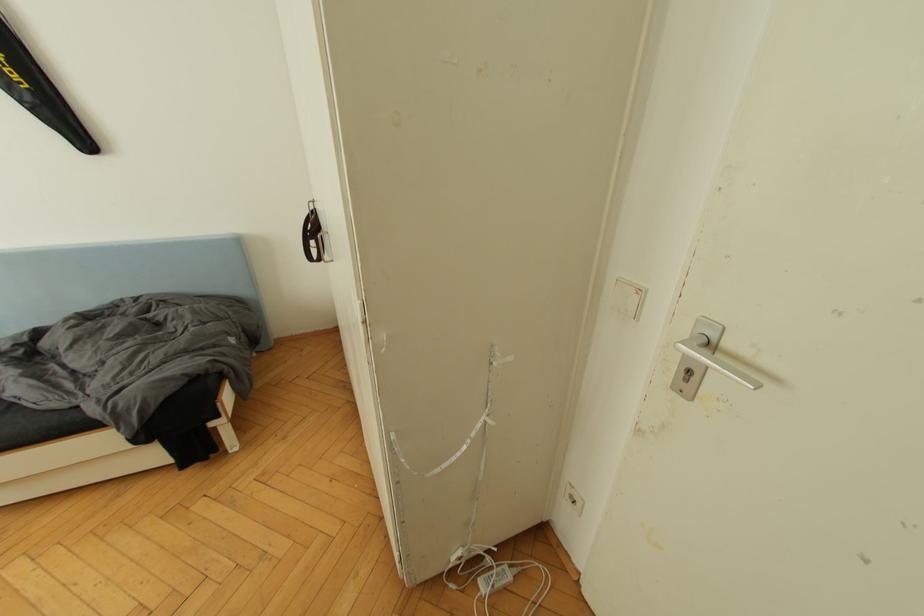
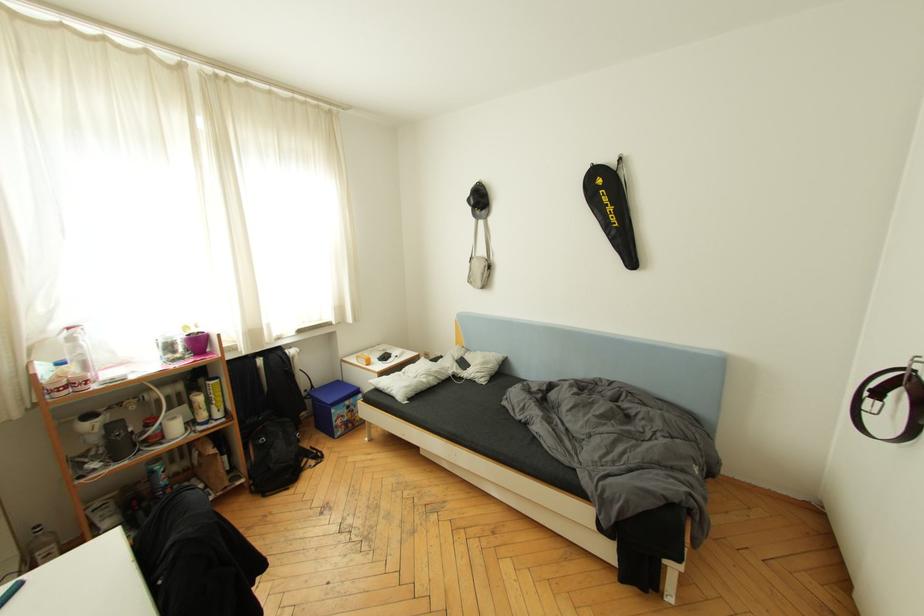
Question: Based on the continuous images, in which direction is the camera rotating? Reply with the corresponding letter.

Choices:
 (A) Left
 (B) Right
 (C) Up
 (D) Down

Answer: (A)